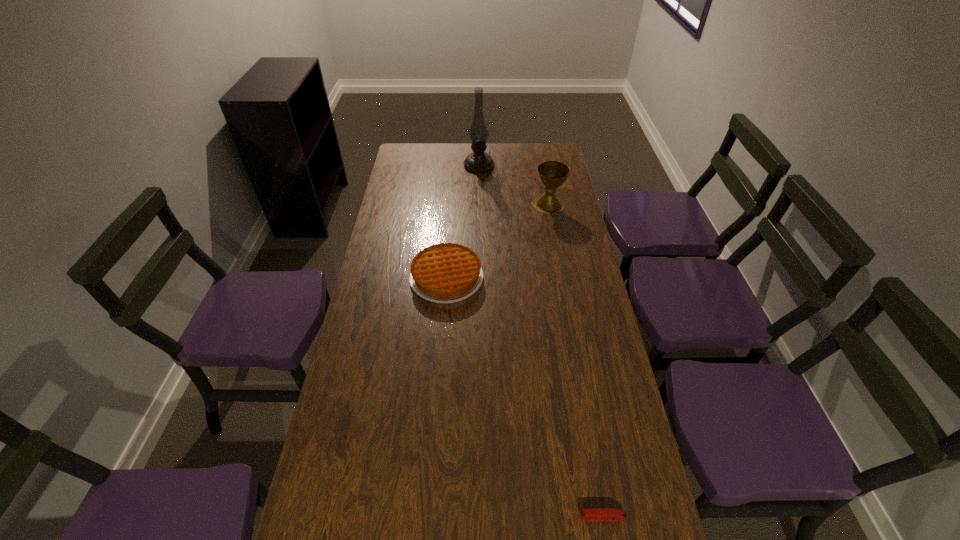
You are a GUI agent. You are given a task and a screenshot of the screen. Output one action in this format:
    pyautogui.click(x=<x>, y=<y>)
    Task: Click on the farthest object
    This screenshot has height=540, width=960.
    Given the screenshot: What is the action you would take?
    pyautogui.click(x=479, y=161)

I want to click on the tallest object, so point(479,161).

Locate an element on the screen. chalice is located at coordinates (552, 174).

Where is `the third nearest object`? the third nearest object is located at coordinates (552, 174).

I want to click on pie, so click(x=444, y=273).

At what (x,y) coordinates should I click in order to perform the action: click on the second nearest object. Please return your answer as a coordinate pair (x, y). The image size is (960, 540). Looking at the image, I should click on (444, 273).

Where is `stapler`? stapler is located at coordinates (610, 514).

You are a GUI agent. You are given a task and a screenshot of the screen. Output one action in this format:
    pyautogui.click(x=<x>, y=<y>)
    Task: Click on the nearest object
    
    Given the screenshot: What is the action you would take?
    pyautogui.click(x=610, y=514)

The height and width of the screenshot is (540, 960). In order to click on vacant point located 0.050m on the left of the tallest object in this screenshot , I will do `click(453, 165)`.

Where is `vacant space located on the front of the second farthest object`? Image resolution: width=960 pixels, height=540 pixels. vacant space located on the front of the second farthest object is located at coordinates [564, 284].